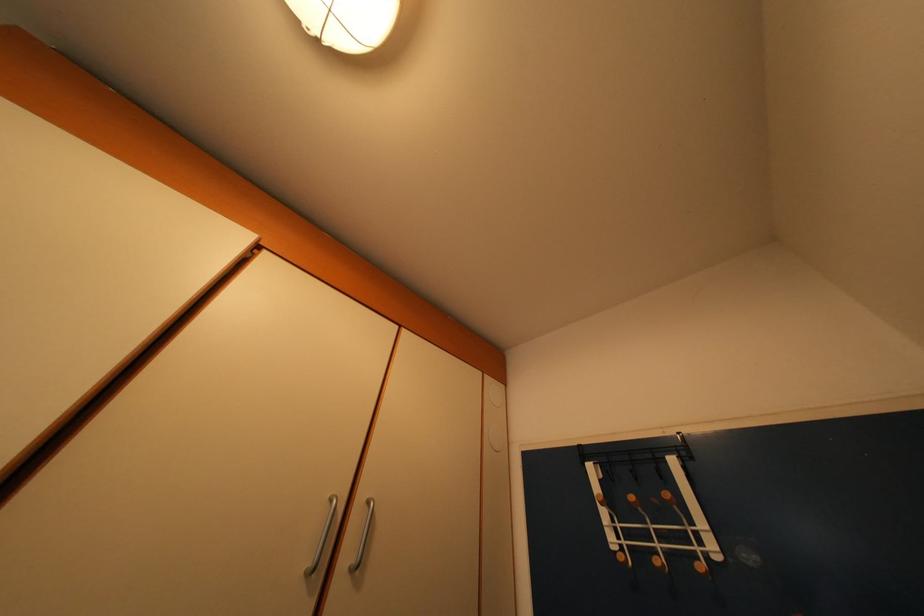
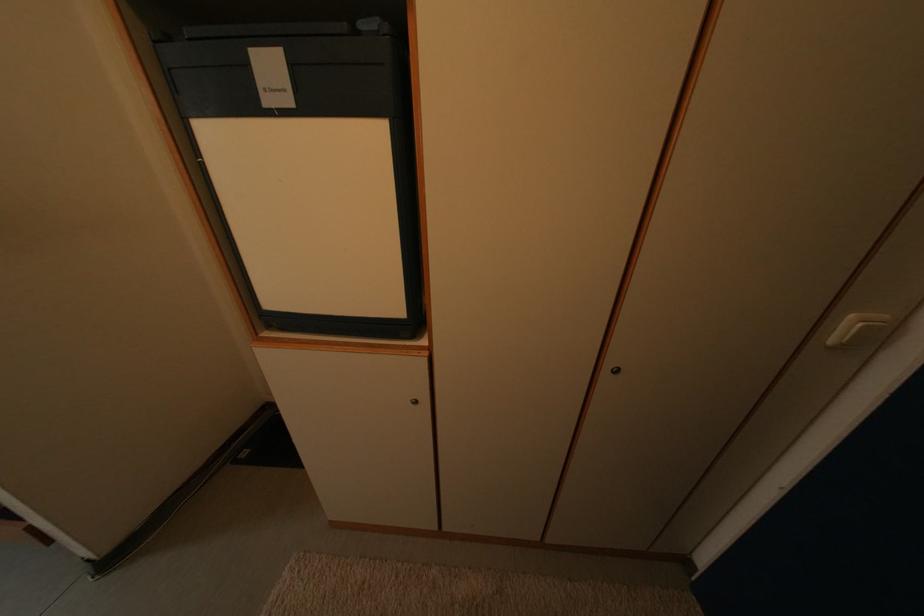
The first image is from the beginning of the video and the second image is from the end. How did the camera likely rotate when shooting the video?

The rotation direction of the camera is left-down.